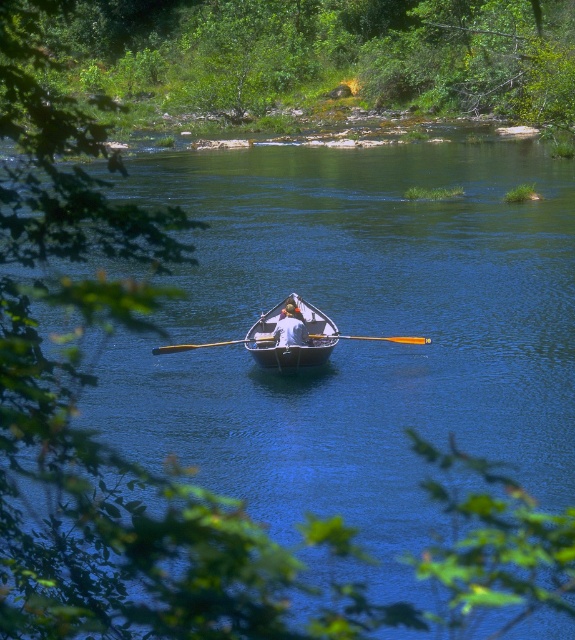
Question: Considering the real-world distances, which object is closest to the yellow wood paddle at center?

Choices:
 (A) white fabric boat at center
 (B) wooden paddle at center

Answer: (B)

Question: Where is wooden rowboat at center located in relation to wooden paddle at center in the image?

Choices:
 (A) left
 (B) right

Answer: (A)

Question: Can you confirm if wooden rowboat at center is positioned above yellow wood paddle at center?

Choices:
 (A) yes
 (B) no

Answer: (B)

Question: Which object is the farthest from the wooden rowboat at center?

Choices:
 (A) wooden paddle at center
 (B) white fabric boat at center

Answer: (A)

Question: Can you confirm if yellow wood paddle at center is positioned above wooden paddle at center?

Choices:
 (A) no
 (B) yes

Answer: (A)

Question: Which object is the farthest from the white fabric boat at center?

Choices:
 (A) wooden paddle at center
 (B) wooden rowboat at center

Answer: (A)